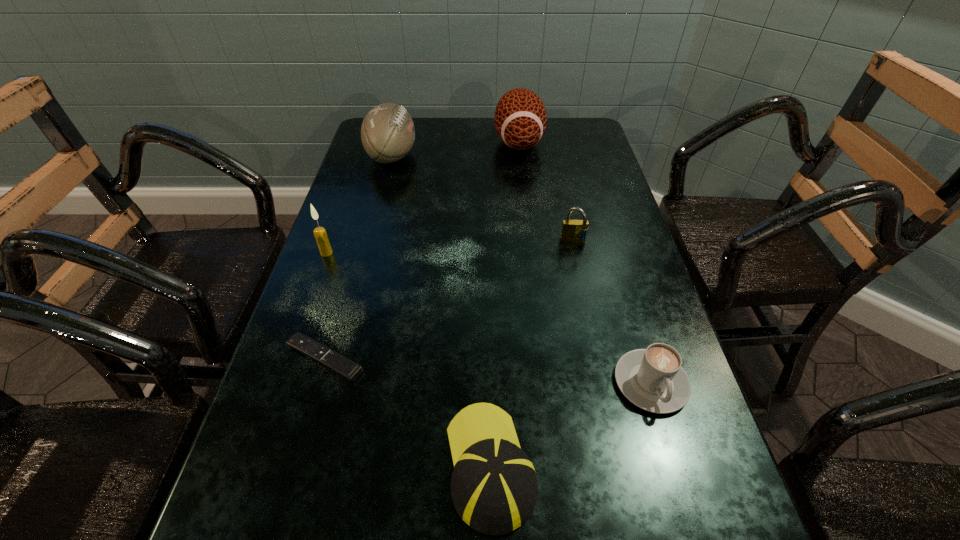
Where is `the right football (American)`? The width and height of the screenshot is (960, 540). the right football (American) is located at coordinates (520, 119).

The height and width of the screenshot is (540, 960). In order to click on the left football (American) in this screenshot , I will do `click(387, 132)`.

Locate an element on the screen. The height and width of the screenshot is (540, 960). candle is located at coordinates (320, 234).

The image size is (960, 540). In order to click on the fourth tallest object in this screenshot , I will do `click(572, 230)`.

This screenshot has width=960, height=540. I want to click on padlock, so click(x=572, y=230).

Find the location of a particular element. baseball cap is located at coordinates (494, 488).

Identify the location of cappuccino. (652, 379).

At what (x,y) coordinates should I click in order to perform the action: click on the shortest object. Please return your answer as a coordinate pair (x, y). Image resolution: width=960 pixels, height=540 pixels. Looking at the image, I should click on (347, 369).

The width and height of the screenshot is (960, 540). In order to click on vacant region located 0.400m on the left of the right football (American) in this screenshot , I will do `click(367, 142)`.

Locate an element on the screen. The height and width of the screenshot is (540, 960). vacant region located 0.110m on the laces of the left football (American) is located at coordinates (454, 156).